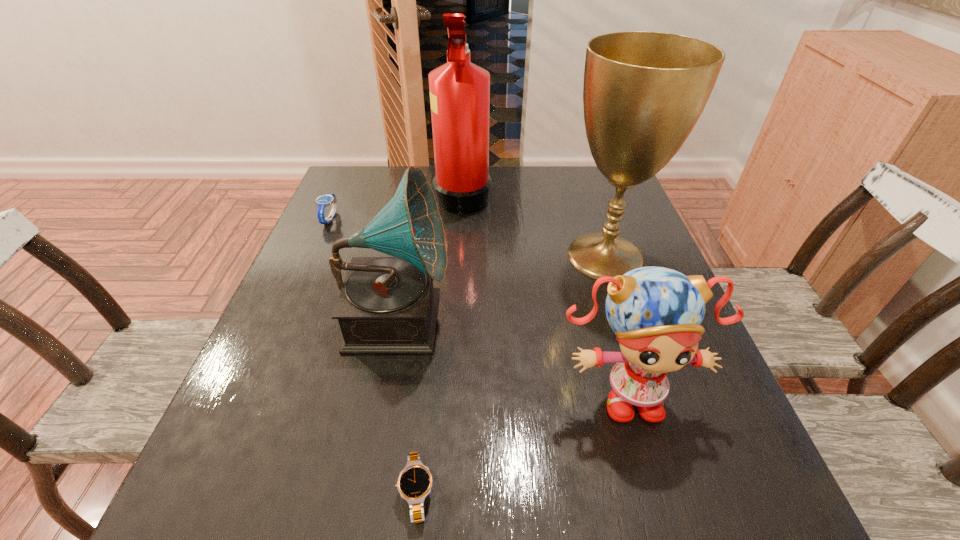
In order to click on vacant area that lies between the record player and the trophy cup in this screenshot , I will do `click(501, 286)`.

The image size is (960, 540). In order to click on free space between the nearer watch and the third tallest object in this screenshot , I will do `click(407, 404)`.

I want to click on empty location between the nearer watch and the second shortest object, so click(372, 355).

At what (x,y) coordinates should I click in order to perform the action: click on vacant region between the trophy cup and the record player. Please return your answer as a coordinate pair (x, y). Looking at the image, I should click on (501, 286).

The height and width of the screenshot is (540, 960). Identify the location of free area in between the fire extinguisher and the trophy cup. (534, 225).

Point out which object is positioned as the third nearest to the trophy cup. Please provide its 2D coordinates. Your answer should be formatted as a tuple, i.e. [(x, y)], where the tuple contains the x and y coordinates of a point satisfying the conditions above.

[(387, 305)]

Identify the location of the second closest object relative to the fourth shortest object. (414, 484).

Locate an element on the screen. The width and height of the screenshot is (960, 540). free space that satisfies the following two spatial constraints: 1. at the spray nozzle of the fire extinguisher; 2. on the front side of the farther watch is located at coordinates (462, 219).

Where is `vacant space that satisfies the following two spatial constraints: 1. at the spray nozzle of the fire extinguisher; 2. on the front side of the leftmost object`? This screenshot has height=540, width=960. vacant space that satisfies the following two spatial constraints: 1. at the spray nozzle of the fire extinguisher; 2. on the front side of the leftmost object is located at coordinates (462, 219).

Locate an element on the screen. This screenshot has height=540, width=960. vacant point that satisfies the following two spatial constraints: 1. on the horn of the record player; 2. on the right side of the right watch is located at coordinates (364, 492).